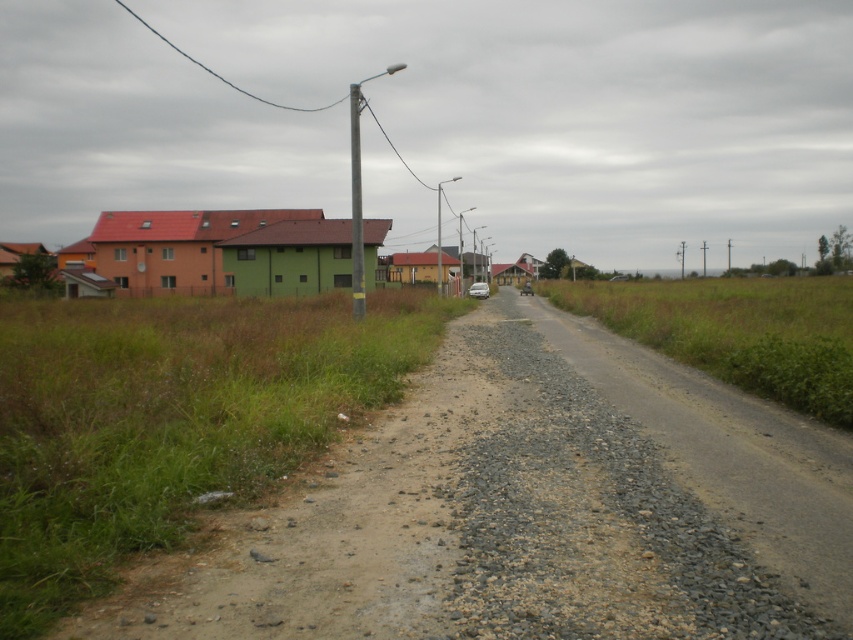
You are driving a matte silver car at center and want to avoid hitting the metallic gray pole at center. Based on the scene, can you determine if you have enough space to steer safely around the pole?

The metallic gray pole at center is closer to the viewer than the matte silver car at center, so there is sufficient space to steer around the pole safely.

You are driving a matte silver car at center and want to park it on the brown gravel dirt track at center. Can you park the car there?

The brown gravel dirt track at center is positioned under the matte silver car at center, so the car is already parked on the track.

You are driving a matte silver car at center and want to park it on the brown gravel dirt track at center. Is there enough space between them to park the car?

The brown gravel dirt track at center and matte silver car at center are 80.04 meters apart, so there is sufficient space to park the matte silver car at center on the brown gravel dirt track at center.